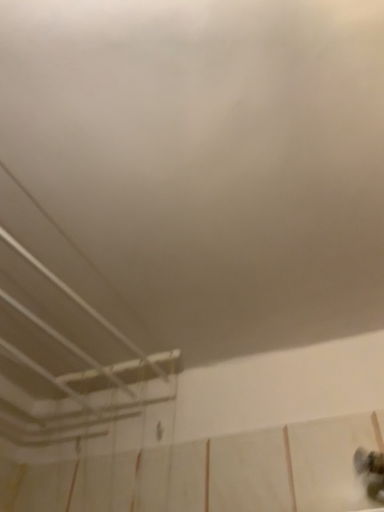
Identify the location of white matte ceiling at upper center. The image size is (384, 512). (208, 161).

This screenshot has height=512, width=384. What do you see at coordinates (208, 161) in the screenshot?
I see `white matte ceiling at upper center` at bounding box center [208, 161].

What are the coordinates of `white matte ceiling at upper center` in the screenshot? It's located at (208, 161).